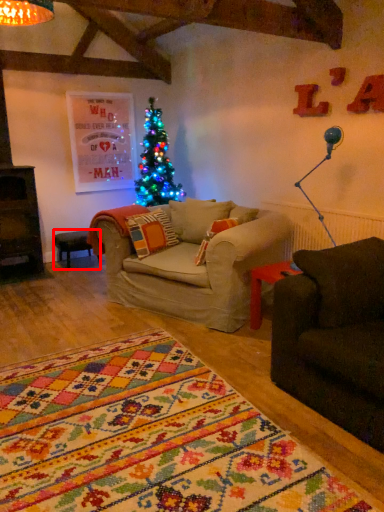
Question: From the image's perspective, where is table (annotated by the red box) located relative to lamp?

Choices:
 (A) above
 (B) below

Answer: (B)